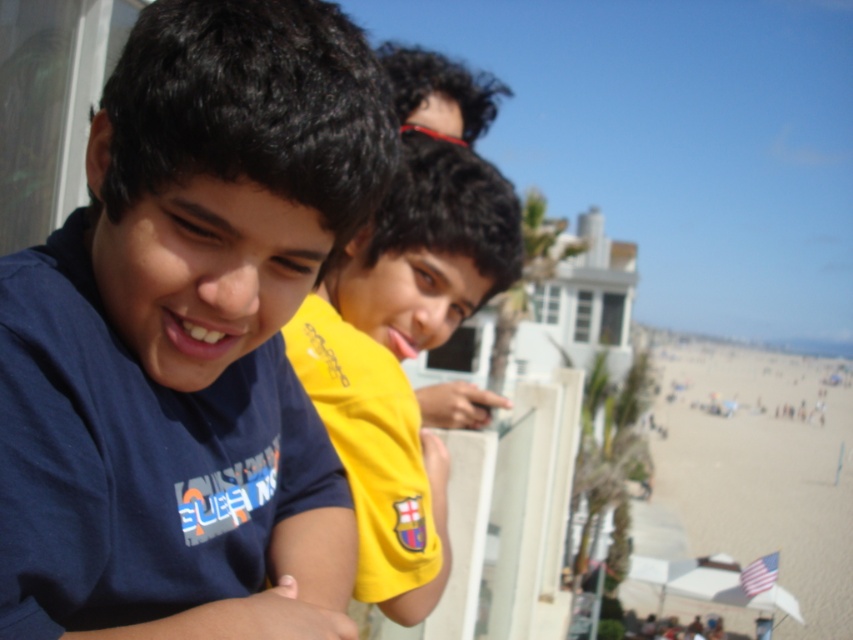
Does blue cotton shirt at left appear under yellow jersey at center?

Correct, blue cotton shirt at left is located below yellow jersey at center.

Which is more to the right, blue cotton shirt at left or yellow jersey at center?

Positioned to the right is yellow jersey at center.

Does point (305, 170) come farther from viewer compared to point (386, 304)?

No, it is in front of (386, 304).

The height and width of the screenshot is (640, 853). I want to click on blue cotton shirt at left, so click(187, 332).